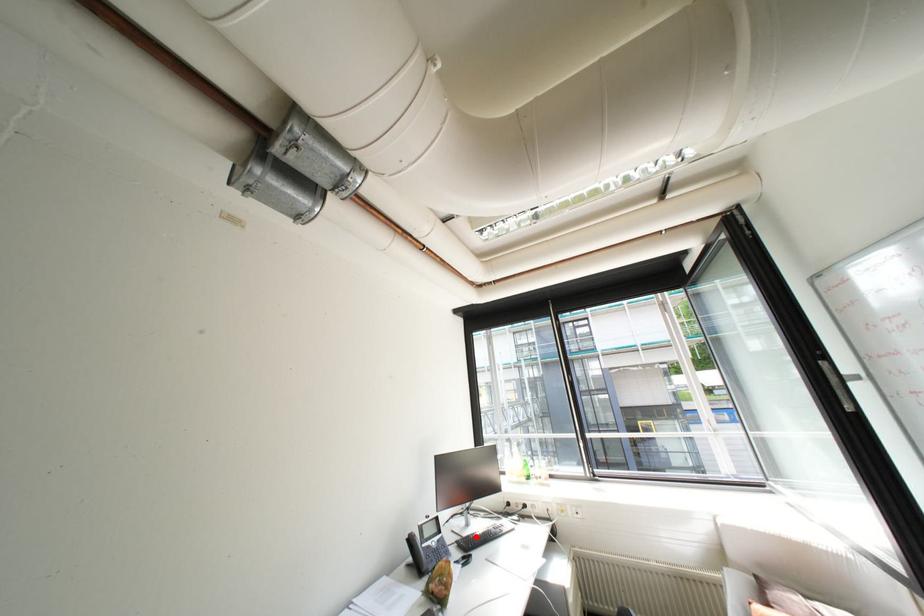
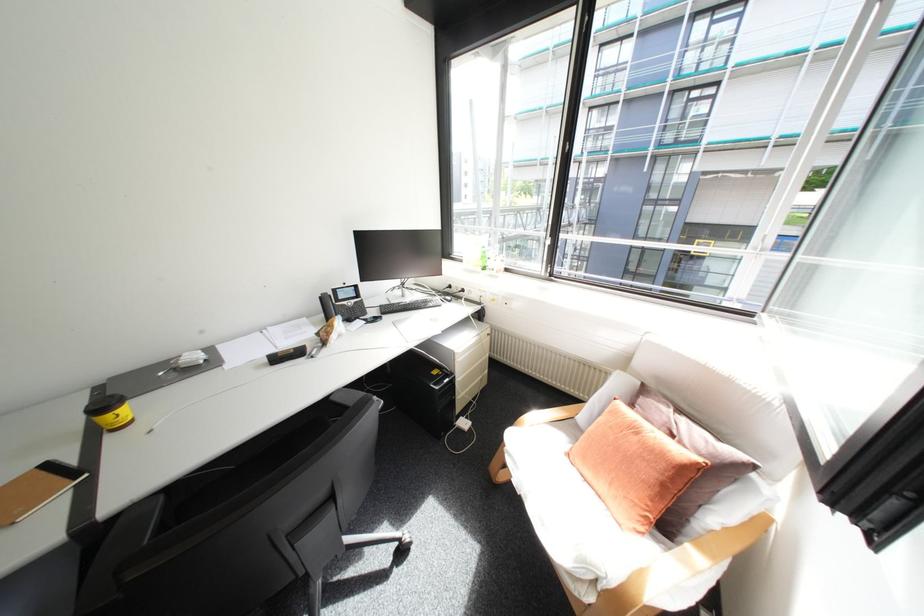
The point at the highlighted location is marked in the first image. Where is the corresponding point in the second image?

(403, 304)